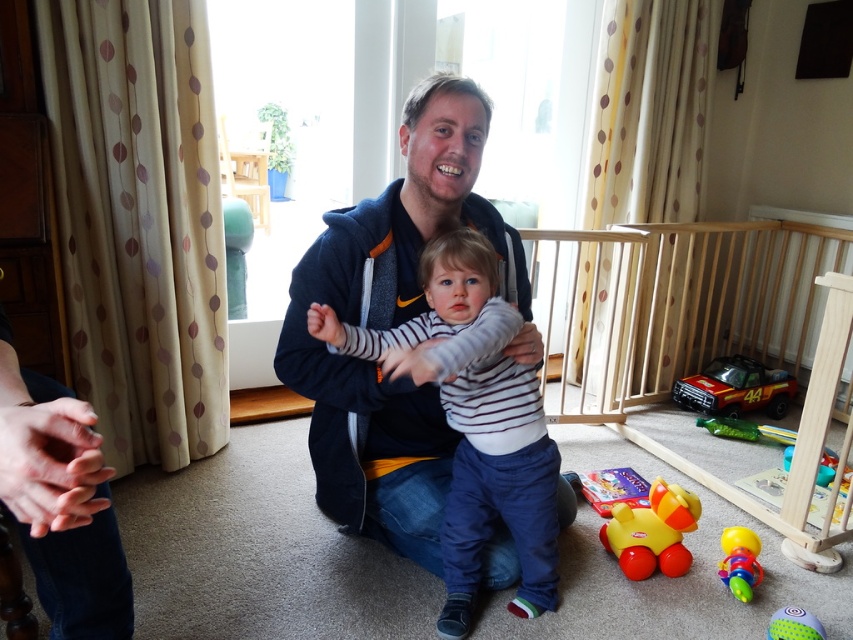
Question: Which point is farther to the camera?

Choices:
 (A) smooth rubber ball at lower right
 (B) matte red plastic toy car at lower right
 (C) rubber duck at lower center
 (D) striped cotton shirt at center

Answer: (B)

Question: Which of the following is the farthest from the observer?

Choices:
 (A) matte red plastic toy car at lower right
 (B) smooth rubber ball at lower right
 (C) rubberized plastic rattle at lower right
 (D) striped cotton shirt at center

Answer: (A)

Question: Can you confirm if smooth skin hands at lower left is thinner than rubberized plastic rattle at lower right?

Choices:
 (A) no
 (B) yes

Answer: (A)

Question: Which point is farther to the camera?

Choices:
 (A) (750, 561)
 (B) (670, 547)
 (C) (114, 557)

Answer: (B)

Question: Can you confirm if smooth skin hands at lower left is positioned below smooth rubber ball at lower right?

Choices:
 (A) yes
 (B) no

Answer: (B)

Question: Does striped cotton shirt at center have a greater width compared to rubberized plastic rattle at lower right?

Choices:
 (A) yes
 (B) no

Answer: (A)